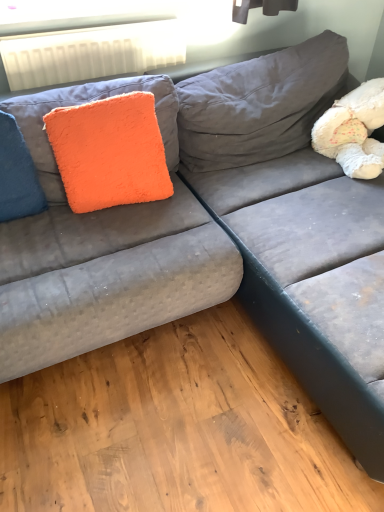
Question: From the image's perspective, is blue fuzzy pillow at left under orange fluffy pillow at upper left?

Choices:
 (A) no
 (B) yes

Answer: (B)

Question: Can you confirm if blue fuzzy pillow at left is thinner than orange fluffy pillow at upper left?

Choices:
 (A) yes
 (B) no

Answer: (B)

Question: Is blue fuzzy pillow at left shorter than orange fluffy pillow at upper left?

Choices:
 (A) yes
 (B) no

Answer: (A)

Question: Considering the relative sizes of blue fuzzy pillow at left and orange fluffy pillow at upper left in the image provided, is blue fuzzy pillow at left bigger than orange fluffy pillow at upper left?

Choices:
 (A) yes
 (B) no

Answer: (B)

Question: Is blue fuzzy pillow at left facing towards orange fluffy pillow at upper left?

Choices:
 (A) yes
 (B) no

Answer: (B)

Question: Is blue fuzzy pillow at left to the left or to the right of orange fluffy pillow at upper left in the image?

Choices:
 (A) right
 (B) left

Answer: (B)

Question: From the image's perspective, relative to orange fluffy pillow at upper left, is blue fuzzy pillow at left above or below?

Choices:
 (A) below
 (B) above

Answer: (A)

Question: From a real-world perspective, is blue fuzzy pillow at left positioned above or below orange fluffy pillow at upper left?

Choices:
 (A) above
 (B) below

Answer: (B)

Question: Considering the positions of blue fuzzy pillow at left and orange fluffy pillow at upper left in the image, is blue fuzzy pillow at left wider or thinner than orange fluffy pillow at upper left?

Choices:
 (A) thin
 (B) wide

Answer: (B)

Question: Is orange fluffy pillow at upper left bigger or smaller than white fluffy teddy bear at upper right?

Choices:
 (A) big
 (B) small

Answer: (B)

Question: From the image's perspective, is orange fluffy pillow at upper left located above or below white fluffy teddy bear at upper right?

Choices:
 (A) below
 (B) above

Answer: (A)

Question: Would you say orange fluffy pillow at upper left is to the left or to the right of white fluffy teddy bear at upper right in the picture?

Choices:
 (A) right
 (B) left

Answer: (B)

Question: From a real-world perspective, is orange fluffy pillow at upper left physically located above or below white fluffy teddy bear at upper right?

Choices:
 (A) above
 (B) below

Answer: (A)

Question: Based on their positions, is white fluffy teddy bear at upper right located to the left or right of blue fuzzy pillow at left?

Choices:
 (A) right
 (B) left

Answer: (A)

Question: Considering the positions of white fluffy teddy bear at upper right and blue fuzzy pillow at left in the image, is white fluffy teddy bear at upper right wider or thinner than blue fuzzy pillow at left?

Choices:
 (A) thin
 (B) wide

Answer: (B)